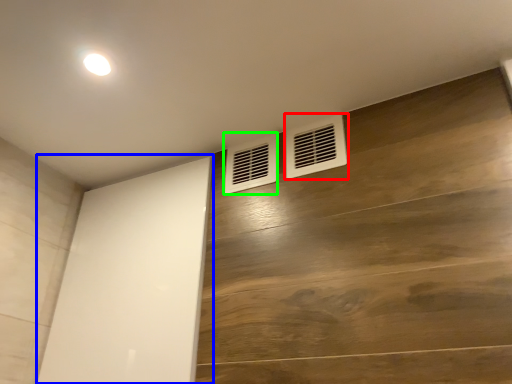
Question: Based on their relative distances, which object is farther from air conditioning (highlighted by a red box)? Choose from screen door (highlighted by a blue box) and air conditioning (highlighted by a green box).

Choices:
 (A) screen door
 (B) air conditioning

Answer: (A)